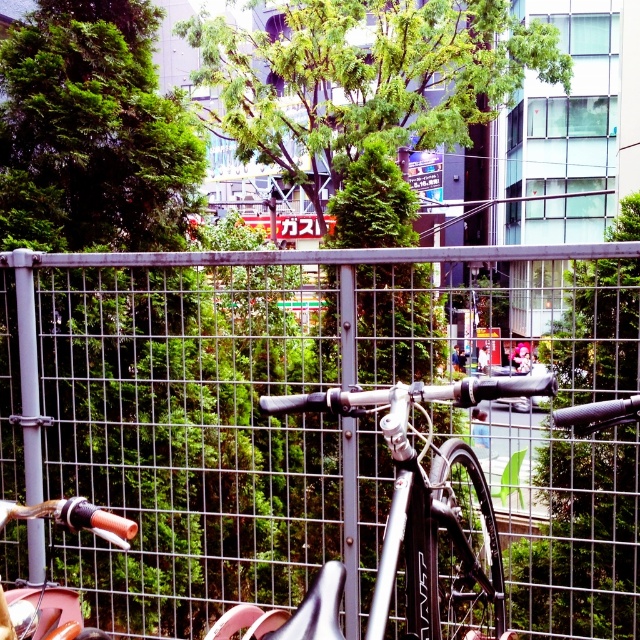
Measure the distance between point (28,429) and camera.

They are 8.31 feet apart.

Is metal mesh fence at center thinner than shiny orange handlebar at left?

Incorrect, metal mesh fence at center's width is not less than shiny orange handlebar at left's.

Describe the element at coordinates (314, 420) in the screenshot. I see `metal mesh fence at center` at that location.

Locate an element on the screen. Image resolution: width=640 pixels, height=640 pixels. metal mesh fence at center is located at coordinates (314, 420).